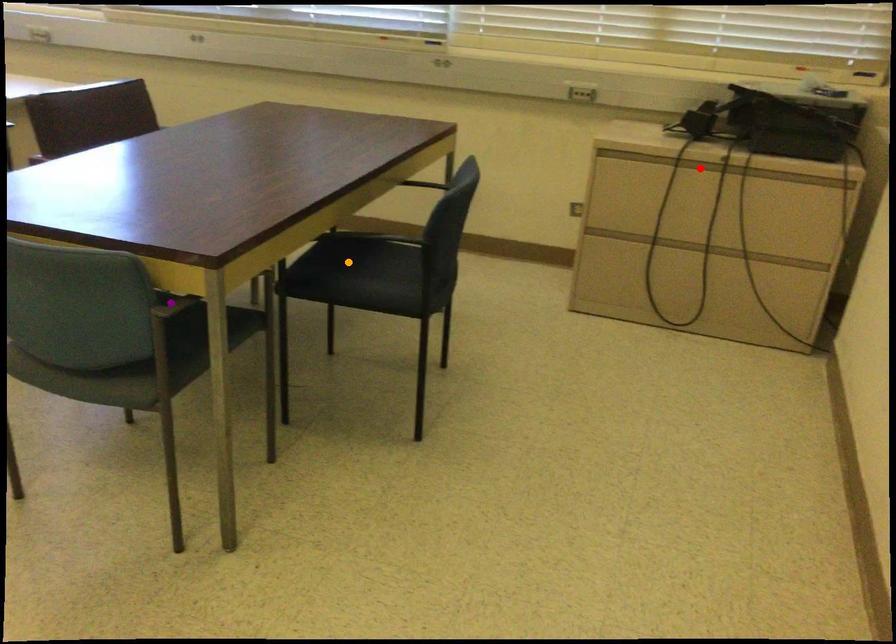
Order these from nearest to farthest:
purple point
orange point
red point

purple point < orange point < red point